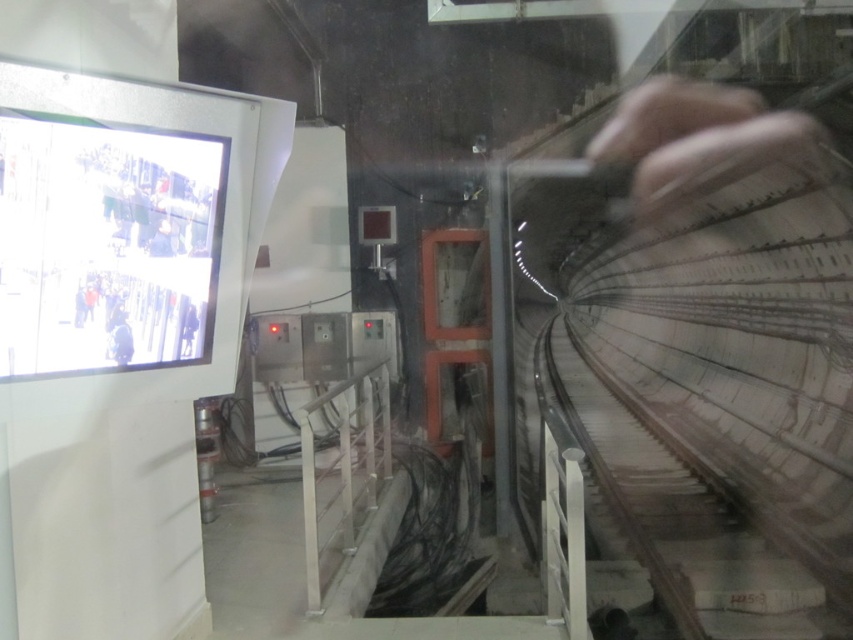
Is smooth concrete train track at right to the right of light gray fabric jacket at left from the viewer's perspective?

Yes, smooth concrete train track at right is to the right of light gray fabric jacket at left.

Is smooth concrete train track at right above light gray fabric jacket at left?

Incorrect, smooth concrete train track at right is not positioned above light gray fabric jacket at left.

Is point (724, 557) positioned behind point (93, 170)?

Yes, it is behind point (93, 170).

At what (x,y) coordinates should I click in order to perform the action: click on smooth concrete train track at right. Please return your answer as a coordinate pair (x, y). Looking at the image, I should click on (682, 522).